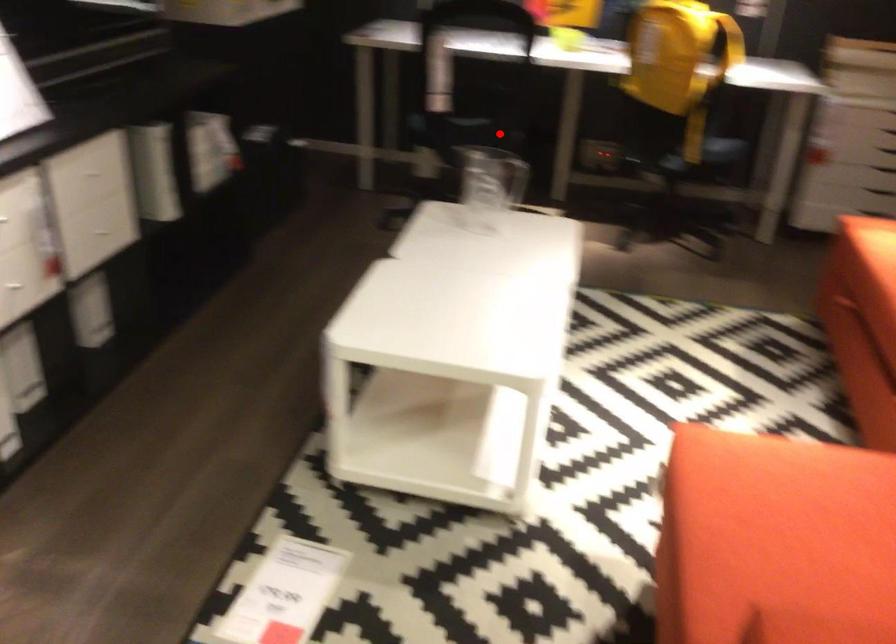
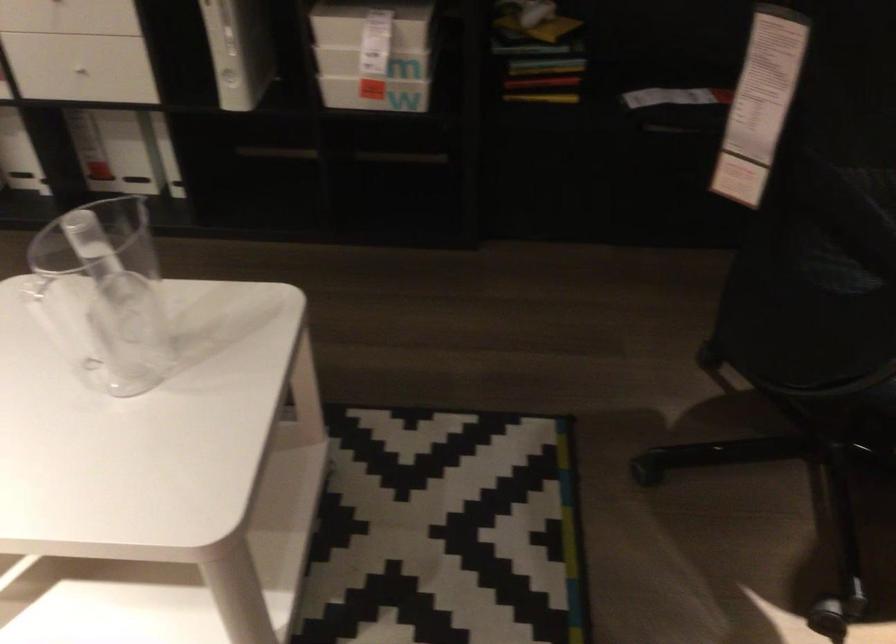
The point at the highlighted location is marked in the first image. Where is the corresponding point in the second image?

(837, 364)